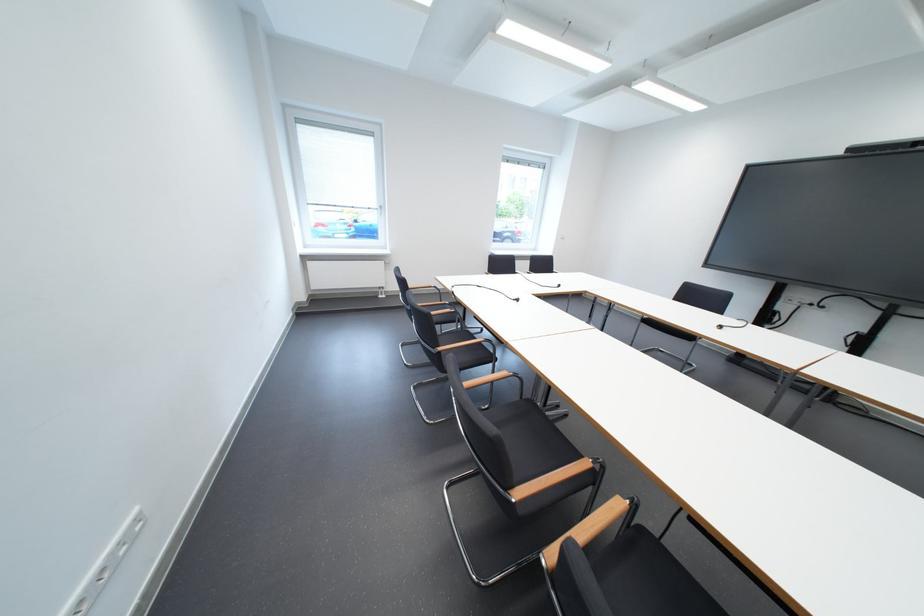
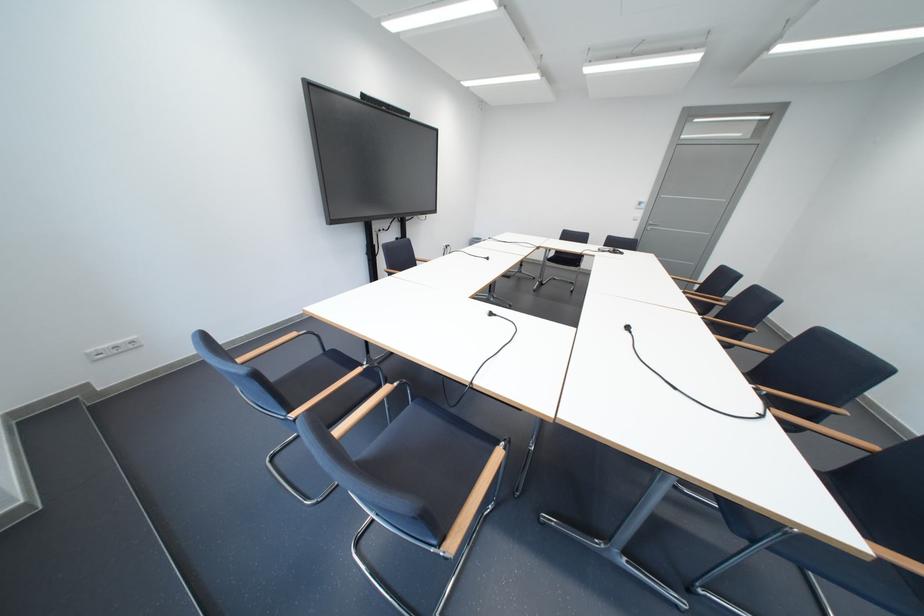
In the second image, find the point that corresponds to [570,288] in the first image.

(503, 315)